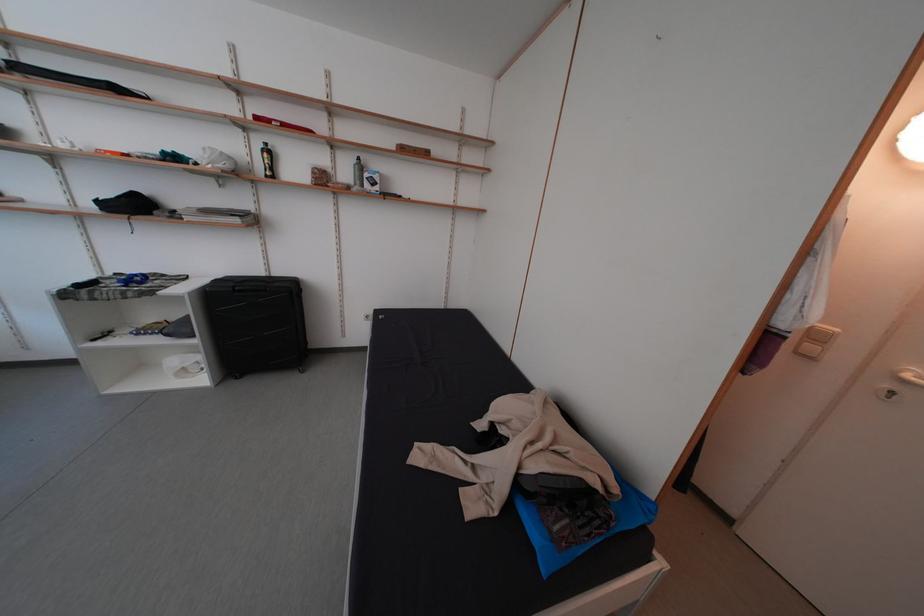
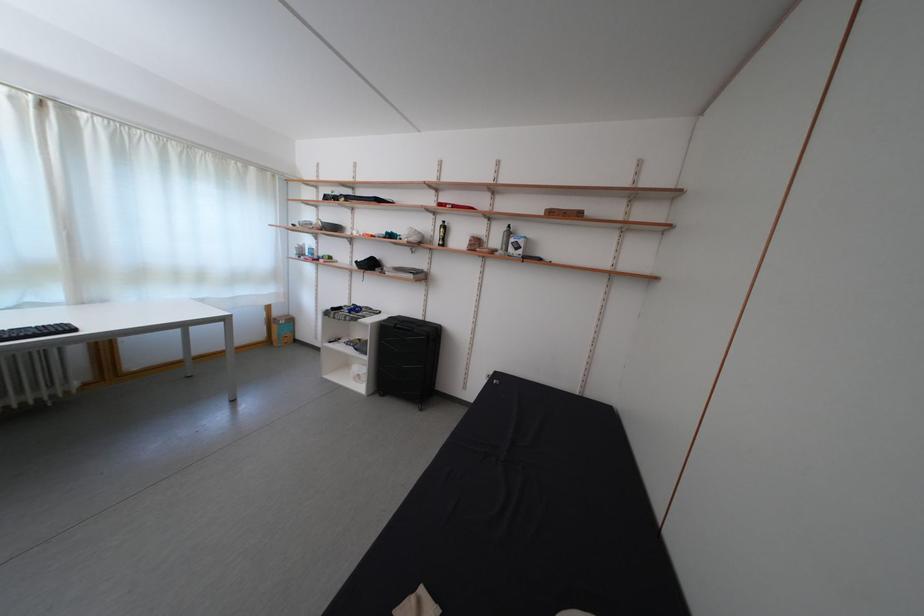
Question: The images are taken continuously from a first-person perspective. In which direction is your viewpoint rotating?

Choices:
 (A) Left
 (B) Right
 (C) Up
 (D) Down

Answer: (A)